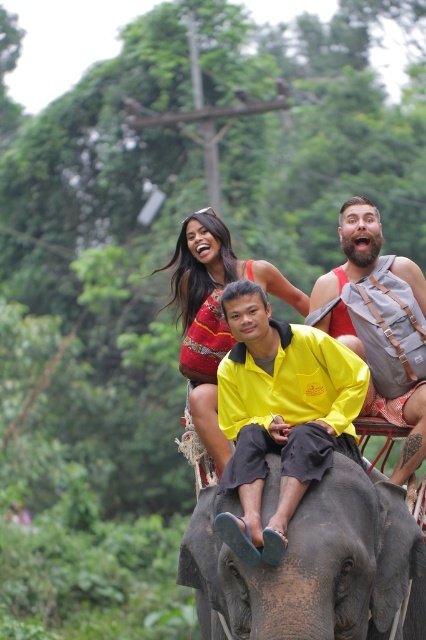
Question: Which of the following is the closest to the observer?

Choices:
 (A) (370, 609)
 (B) (417, 337)
 (C) (250, 522)
 (D) (181, 246)

Answer: (C)

Question: Does yellow matte shirt at center have a smaller size compared to bearded man with backpack at upper right?

Choices:
 (A) yes
 (B) no

Answer: (A)

Question: Does gray matte elephant at center have a larger size compared to bearded man with backpack at upper right?

Choices:
 (A) yes
 (B) no

Answer: (B)

Question: Which object appears farthest from the camera in this image?

Choices:
 (A) reddish-brown fabric dress at upper center
 (B) bearded man with backpack at upper right

Answer: (A)

Question: Estimate the real-world distances between objects in this image. Which object is closer to the gray matte elephant at center?

Choices:
 (A) bearded man with backpack at upper right
 (B) reddish-brown fabric dress at upper center

Answer: (A)

Question: Is the position of gray matte elephant at center less distant than that of bearded man with backpack at upper right?

Choices:
 (A) yes
 (B) no

Answer: (A)